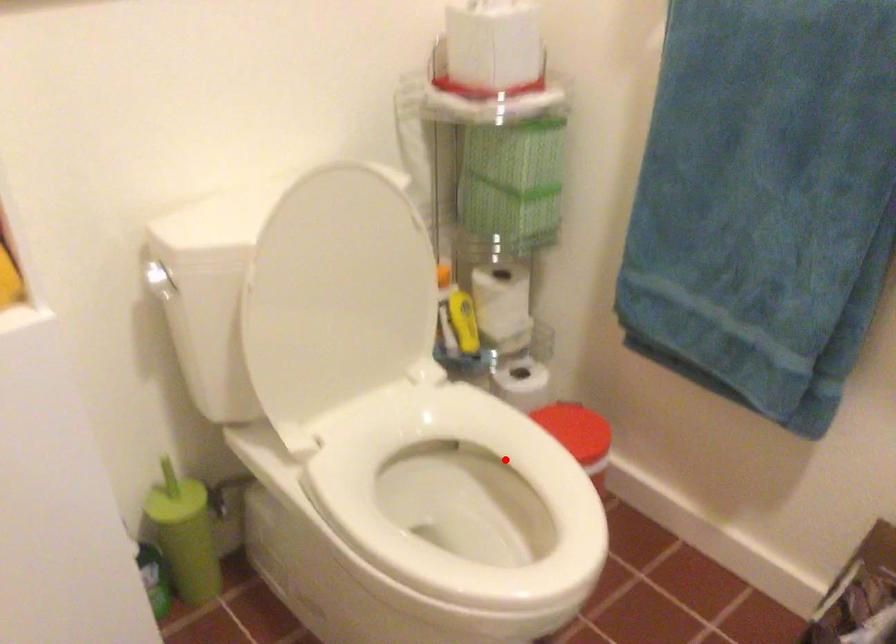
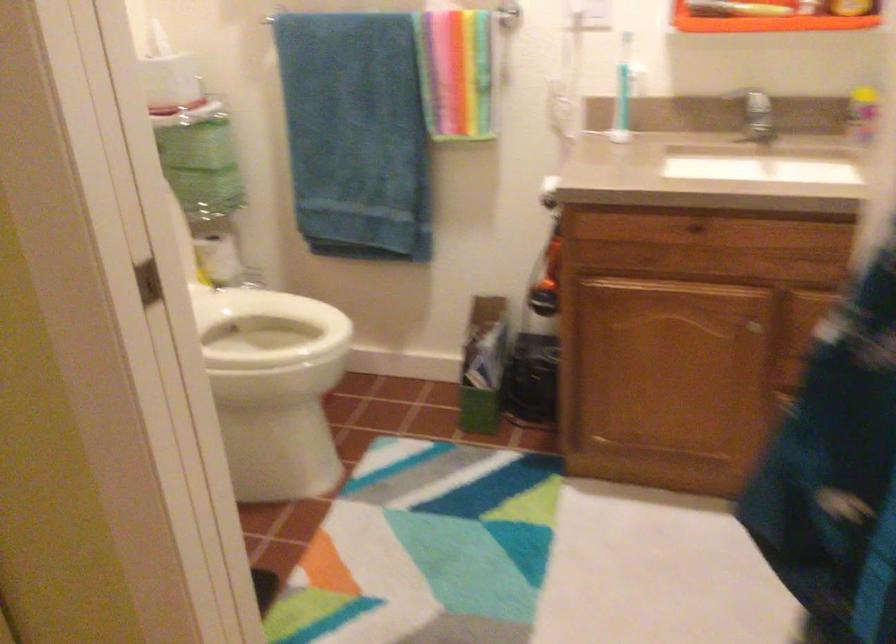
Question: I am providing you with two images of the same scene from different viewpoints. In image1, a red point is highlighted. Considering the same 3D point in image2, which of the following is correct?

Choices:
 (A) It is closer
 (B) It is farther

Answer: (B)